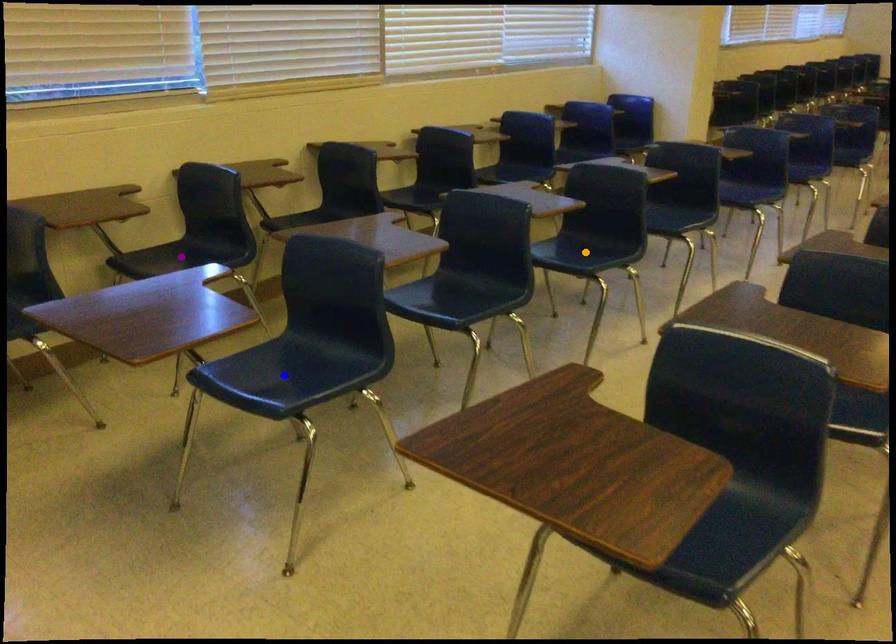
Order these from nearest to farthest:
1. orange point
2. purple point
3. blue point

blue point
purple point
orange point